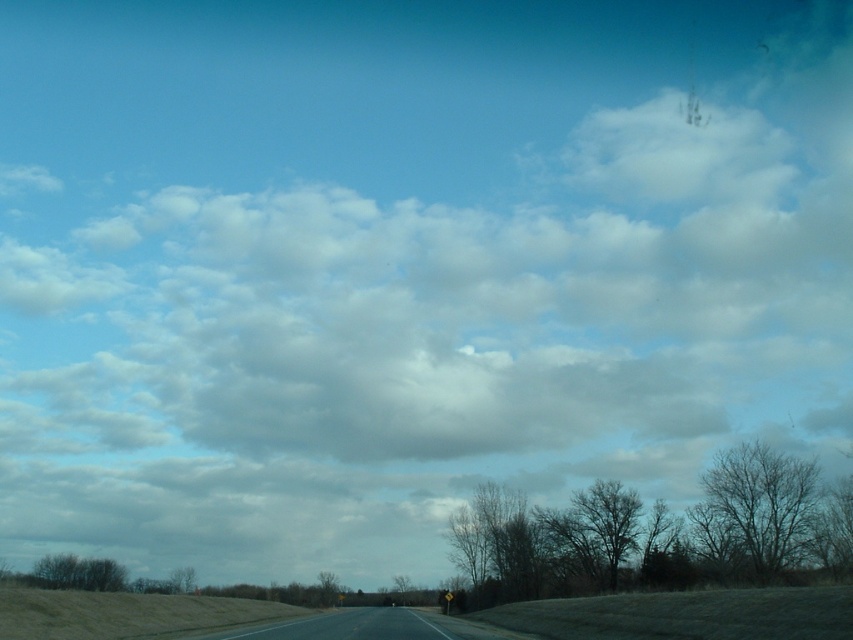
Who is more distant from viewer, [799,496] or [372,612]?

Positioned behind is point [372,612].

Is bare branches at right taller than asphalt road at center?

In fact, bare branches at right may be shorter than asphalt road at center.

The height and width of the screenshot is (640, 853). Find the location of `bare branches at right`. bare branches at right is located at coordinates (764, 500).

The width and height of the screenshot is (853, 640). Find the location of `bare branches at right`. bare branches at right is located at coordinates (764, 500).

Does bare branches at right appear over dark brown textured tree at center?

Yes.

Where is `bare branches at right`? This screenshot has width=853, height=640. bare branches at right is located at coordinates (764, 500).

Can you confirm if bare branches at center is taller than asphalt road at center?

Incorrect, bare branches at center's height is not larger of asphalt road at center's.

Identify the location of bare branches at center. This screenshot has height=640, width=853. 659,532.